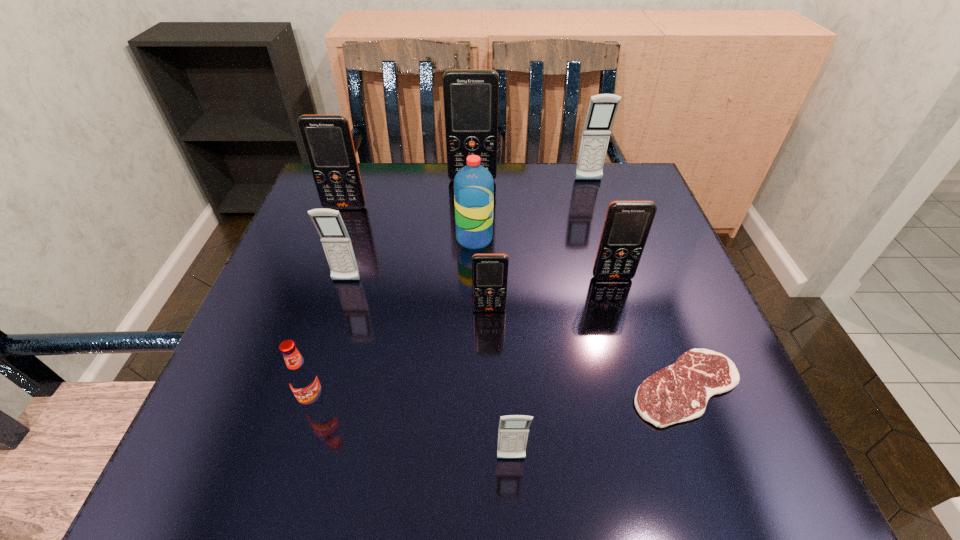
The image size is (960, 540). I want to click on root beer present at the left edge, so click(x=302, y=377).

This screenshot has width=960, height=540. Identify the location of steak at the right edge. (680, 392).

Locate an element on the screen. This screenshot has height=540, width=960. object present at the far left corner is located at coordinates (327, 139).

Where is `object that is at the far right corner`? Image resolution: width=960 pixels, height=540 pixels. object that is at the far right corner is located at coordinates (602, 109).

Locate an element on the screen. This screenshot has width=960, height=540. object located at the near right corner is located at coordinates (680, 392).

Locate an element on the screen. The height and width of the screenshot is (540, 960). vacant area at the far edge of the desktop is located at coordinates (436, 204).

At what (x,y) coordinates should I click in order to perform the action: click on free space at the near edge of the desktop. Please return your answer as a coordinate pair (x, y). Looking at the image, I should click on (363, 437).

The height and width of the screenshot is (540, 960). I want to click on vacant area at the left edge of the desktop, so click(x=333, y=301).

I want to click on free space at the right edge of the desktop, so click(677, 256).

Find the location of a particular element. vacant region at the far left corner of the desktop is located at coordinates (315, 185).